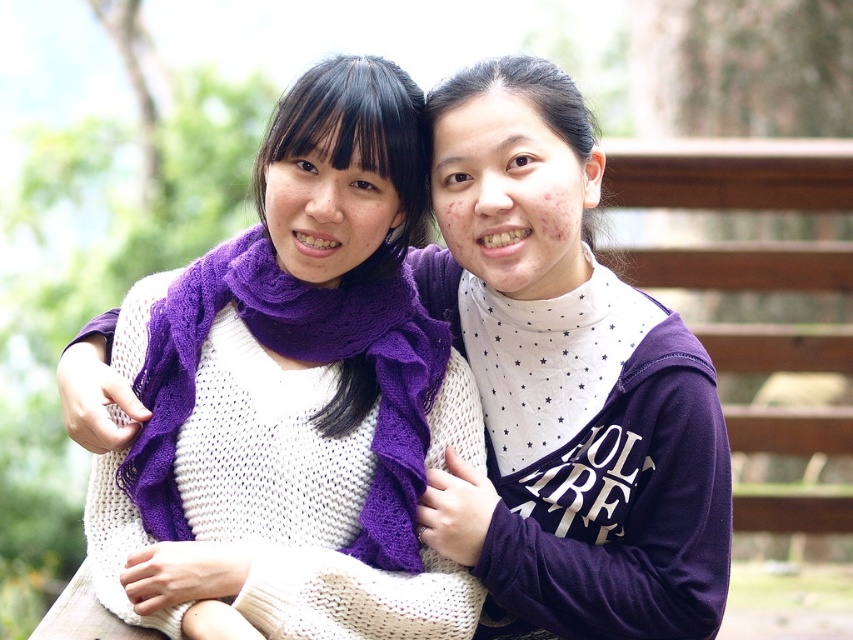
Based on the provided scene description, what are the coordinates of the purple knitted scarf at center in the image?

The coordinates of the purple knitted scarf at center are at point (293, 397).

In the scene shown: You are a photographer trying to capture a closeup of the purple knitted scarves in the image. Given that both scarves are purple and knitted, how can you distinguish between the purple knitted scarf at center and the purple knitted scarf at left based on their sizes?

The purple knitted scarf at center is larger in size compared to the purple knitted scarf at left, so you can identify the larger one as the one at center and the smaller one as the one at left.

Consider the image. You are a photographer trying to capture a close portrait of both the purple knit sweater at center and the purple knitted scarf at left in the image. Given that your camera has a focus range of 20 inches, can you fit both objects within the focus range without moving the camera?

The purple knit sweater at center and purple knitted scarf at left are 22.49 inches apart, which exceeds the camera focus range of 20 inches. Therefore, you cannot fit both objects within the focus range without moving the camera.